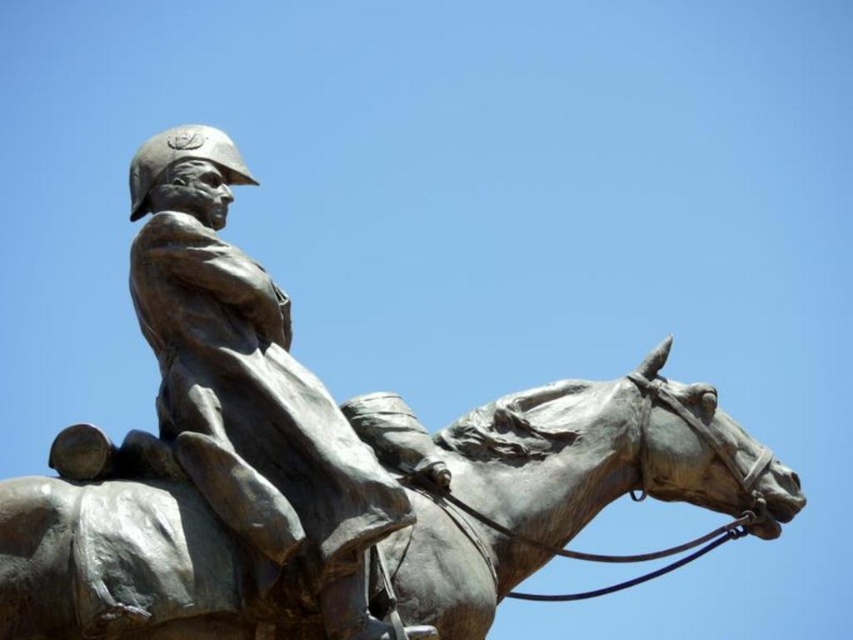
Image resolution: width=853 pixels, height=640 pixels. What do you see at coordinates (572, 484) in the screenshot? I see `bronze horse at center` at bounding box center [572, 484].

Measure the distance between bronze horse at center and camera.

bronze horse at center is 61.29 meters away from camera.

Where is `bronze horse at center`? Image resolution: width=853 pixels, height=640 pixels. bronze horse at center is located at coordinates (572, 484).